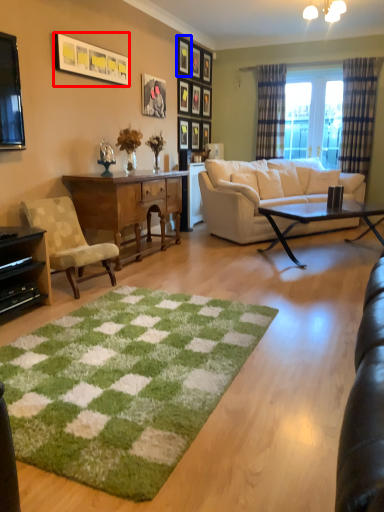
Question: Which point is further to the camera, picture frame (highlighted by a red box) or picture frame (highlighted by a blue box)?

Choices:
 (A) picture frame
 (B) picture frame

Answer: (B)